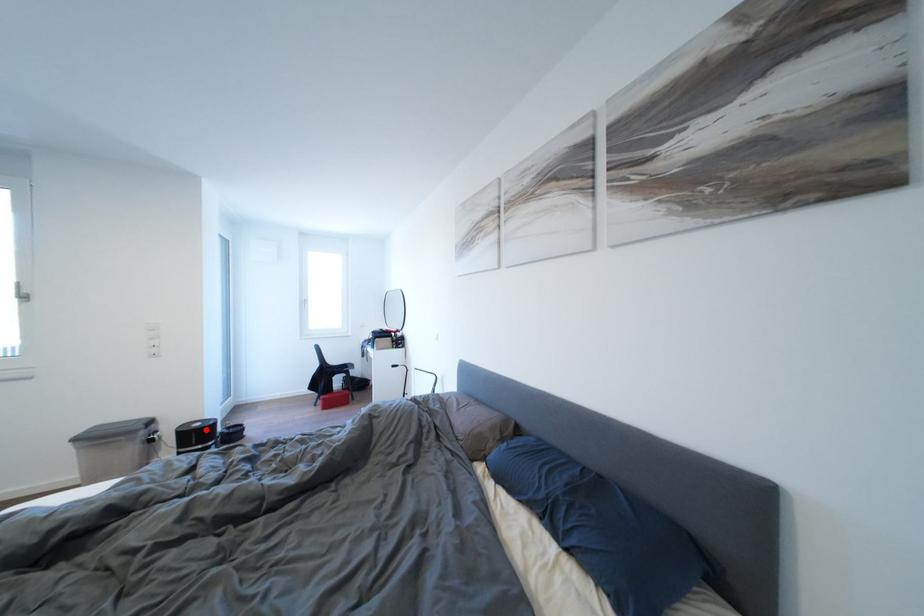
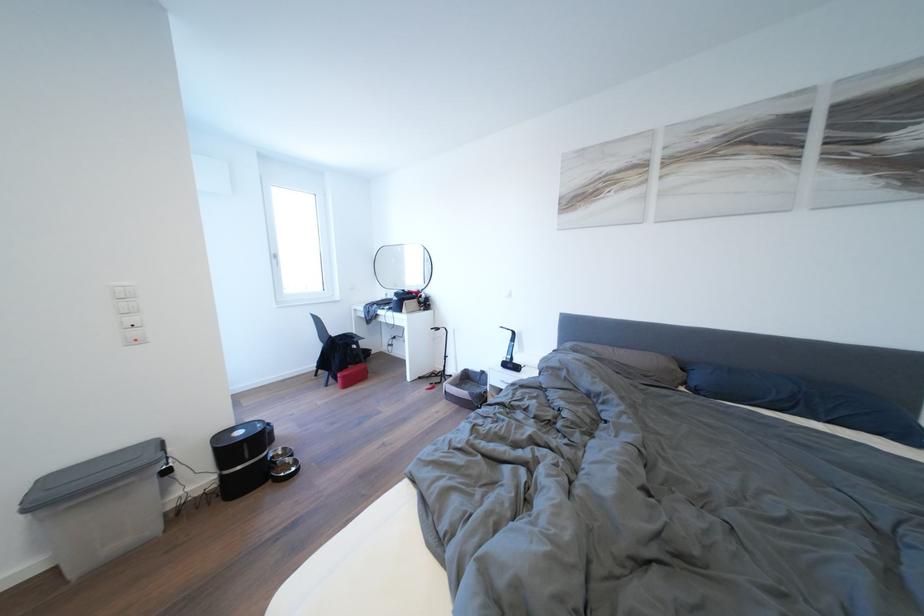
The point at the highlighted location is marked in the first image. Where is the corresponding point in the second image?

(248, 438)